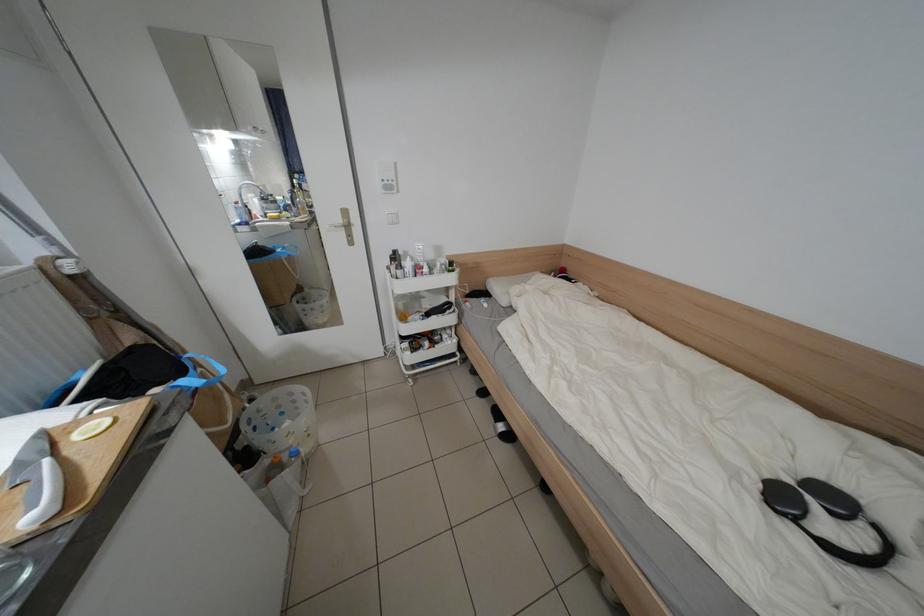
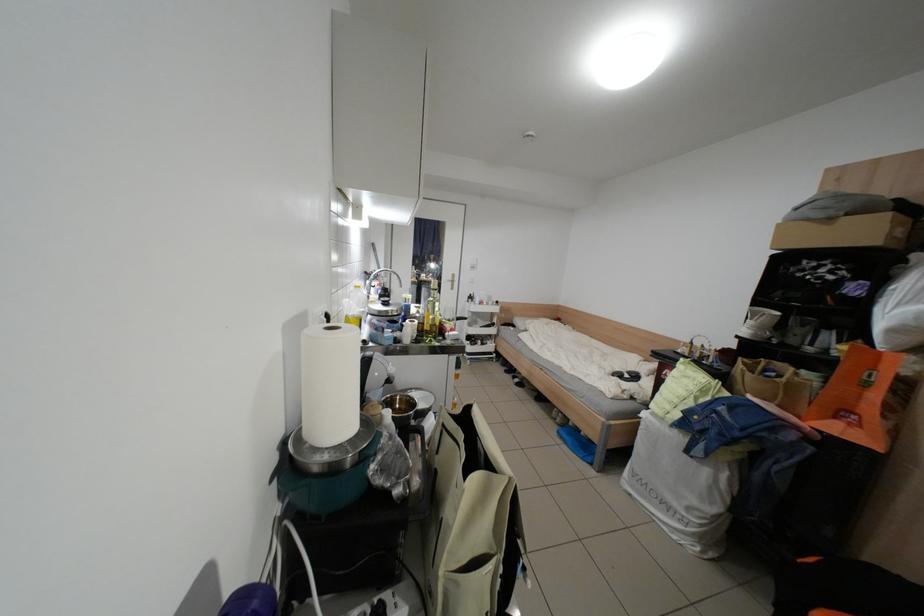
Question: Which direction would the cameraman need to move to produce the second image? Reply with the corresponding letter.

Choices:
 (A) Left
 (B) Right
 (C) Forward
 (D) Backward

Answer: (D)